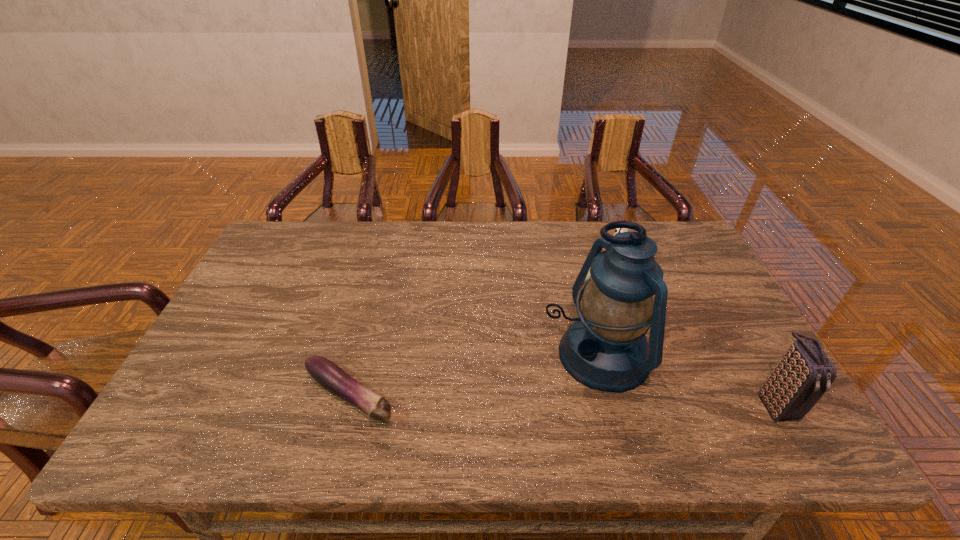
You are a GUI agent. You are given a task and a screenshot of the screen. Output one action in this format:
    pyautogui.click(x=<x>, y=<y>)
    Task: Click on the free spot on the desktop that is between the eggplant and the clutch bag and is positioned at the face of the bird
    The height and width of the screenshot is (540, 960).
    Given the screenshot: What is the action you would take?
    pyautogui.click(x=526, y=400)

You are a GUI agent. You are given a task and a screenshot of the screen. Output one action in this format:
    pyautogui.click(x=<x>, y=<y>)
    Task: Click on the vacant spot on the desktop that is between the leftmost object and the rightmost object and is positioned on the face of the lantern
    This screenshot has height=540, width=960.
    Given the screenshot: What is the action you would take?
    pyautogui.click(x=505, y=400)